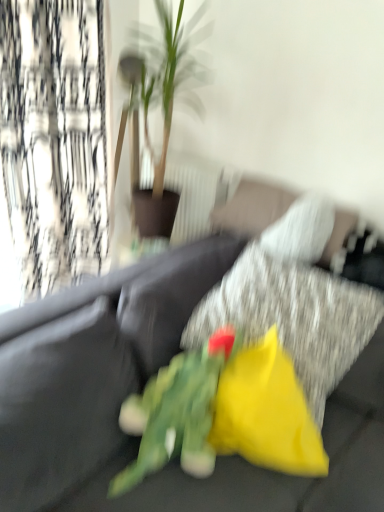
Describe the element at coordinates (223, 413) in the screenshot. The width and height of the screenshot is (384, 512). I see `green fabric flower at center` at that location.

Locate an element on the screen. The width and height of the screenshot is (384, 512). yellow fabric flower at center is located at coordinates (266, 412).

Identify the location of yellow fabric pillow at center. (293, 317).

Could you tell me if velvet dark gray couch at center is turned towards black textured curtain at left?

No, velvet dark gray couch at center is not turned towards black textured curtain at left.

Is black textured curtain at left completely or partially inside velvet dark gray couch at center?

No, black textured curtain at left is not inside velvet dark gray couch at center.

Identify the location of studio couch below the black textured curtain at left (from a real-world perspective). (91, 365).

Does velvet dark gray couch at center appear on the right side of black textured curtain at left?

Yes, velvet dark gray couch at center is to the right of black textured curtain at left.

Is green fabric flower at center located within black textured curtain at left?

Definitely not — green fabric flower at center is not inside black textured curtain at left.

Which point is more forward, (x=14, y=227) or (x=244, y=451)?

The point (x=244, y=451) is more forward.

Is black textured curtain at left positioned behind green fabric flower at center?

Yes, it is behind green fabric flower at center.

From a real-world perspective, is black textured curtain at left positioned over yellow fabric flower at center based on gravity?

Correct, in the physical world, black textured curtain at left is higher than yellow fabric flower at center.

Considering the relative sizes of black textured curtain at left and yellow fabric flower at center in the image provided, is black textured curtain at left bigger than yellow fabric flower at center?

Indeed, black textured curtain at left has a larger size compared to yellow fabric flower at center.

From their relative heights in the image, would you say black textured curtain at left is taller or shorter than yellow fabric flower at center?

Considering their sizes, black textured curtain at left has more height than yellow fabric flower at center.

Does yellow fabric flower at center touch black textured curtain at left?

No.

In terms of size, does yellow fabric flower at center appear bigger or smaller than black textured curtain at left?

Clearly, yellow fabric flower at center is smaller in size than black textured curtain at left.

From the picture: Does yellow fabric flower at center lie behind black textured curtain at left?

No.

Is yellow fabric flower at center shorter than black textured curtain at left?

Correct, yellow fabric flower at center is not as tall as black textured curtain at left.

Considering the sizes of black textured curtain at left and green leafy plant at center in the image, is black textured curtain at left bigger or smaller than green leafy plant at center?

Clearly, black textured curtain at left is larger in size than green leafy plant at center.

Is black textured curtain at left next to green leafy plant at center and touching it?

There is a gap between black textured curtain at left and green leafy plant at center.

From a real-world perspective, is black textured curtain at left beneath green leafy plant at center?

Indeed, from a real-world perspective, black textured curtain at left is positioned beneath green leafy plant at center.

Is black textured curtain at left surrounding green leafy plant at center?

No.

Measure the distance from green leafy plant at center to yellow fabric pillow at center.

green leafy plant at center is 38.39 inches from yellow fabric pillow at center.

Relative to yellow fabric pillow at center, is green leafy plant at center in front or behind?

Visually, green leafy plant at center is located behind yellow fabric pillow at center.

Is green leafy plant at center wider than yellow fabric pillow at center?

Correct, the width of green leafy plant at center exceeds that of yellow fabric pillow at center.

Could you tell me if green leafy plant at center is turned towards yellow fabric pillow at center?

No, green leafy plant at center does not turn towards yellow fabric pillow at center.

Consider the image. From the image's perspective, which one is positioned higher, velvet dark gray couch at center or yellow fabric flower at center?

From the image's view, yellow fabric flower at center is above.

Does velvet dark gray couch at center contain yellow fabric flower at center?

Yes, yellow fabric flower at center is a part of velvet dark gray couch at center.

In the image, is velvet dark gray couch at center on the left side or the right side of yellow fabric flower at center?

Based on their positions, velvet dark gray couch at center is located to the left of yellow fabric flower at center.

Who is bigger, velvet dark gray couch at center or yellow fabric flower at center?

Bigger between the two is velvet dark gray couch at center.

Locate an element on the screen. curtain behind the velvet dark gray couch at center is located at coordinates (53, 145).

This screenshot has height=512, width=384. Identify the location of curtain located above the green fabric flower at center (from a real-world perspective). (53, 145).

Which object lies nearer to the anchor point velvet dark gray couch at center, yellow fabric pillow at center or yellow fabric flower at center?

yellow fabric pillow at center is closer to velvet dark gray couch at center.

Based on their spatial positions, is yellow fabric pillow at center or green fabric flower at center closer to yellow fabric flower at center?

green fabric flower at center.

Estimate the real-world distances between objects in this image. Which object is closer to yellow fabric flower at center, black textured curtain at left or green fabric flower at center?

Based on the image, green fabric flower at center appears to be nearer to yellow fabric flower at center.

From the image, which object appears to be nearer to velvet dark gray couch at center, black textured curtain at left or yellow fabric pillow at center?

yellow fabric pillow at center is closer to velvet dark gray couch at center.

Estimate the real-world distances between objects in this image. Which object is closer to yellow fabric pillow at center, black textured curtain at left or yellow fabric flower at center?

yellow fabric flower at center is positioned closer to the anchor yellow fabric pillow at center.

Based on their spatial positions, is yellow fabric flower at center or black textured curtain at left closer to velvet dark gray couch at center?

yellow fabric flower at center is positioned closer to the anchor velvet dark gray couch at center.

Which object lies further to the anchor point yellow fabric flower at center, black textured curtain at left or green leafy plant at center?

black textured curtain at left.

From the image, which object appears to be nearer to yellow fabric flower at center, green fabric flower at center or green leafy plant at center?

Based on the image, green fabric flower at center appears to be nearer to yellow fabric flower at center.

This screenshot has width=384, height=512. What are the coordinates of `flower between velvet dark gray couch at center and yellow fabric pillow at center from front to back` in the screenshot? It's located at (266, 412).

This screenshot has height=512, width=384. What are the coordinates of `pillow between green leafy plant at center and velvet dark gray couch at center from top to bottom` in the screenshot? It's located at (293, 317).

The width and height of the screenshot is (384, 512). Identify the location of pillow between green leafy plant at center and yellow fabric flower at center in the up-down direction. (293, 317).

Where is `flower located between black textured curtain at left and yellow fabric pillow at center in the left-right direction`? The image size is (384, 512). flower located between black textured curtain at left and yellow fabric pillow at center in the left-right direction is located at coordinates (266, 412).